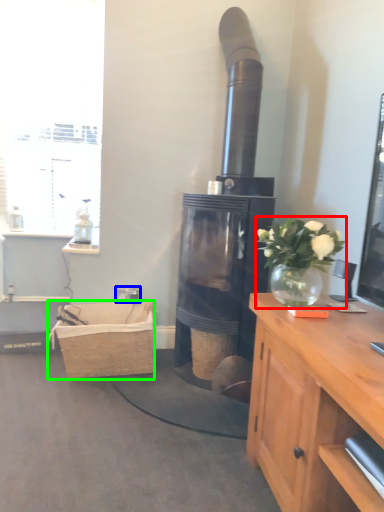
Question: Based on their relative distances, which object is nearer to houseplant (highlighted by a red box)? Choose from power outlet (highlighted by a blue box) and picnic basket (highlighted by a green box).

Choices:
 (A) power outlet
 (B) picnic basket

Answer: (B)